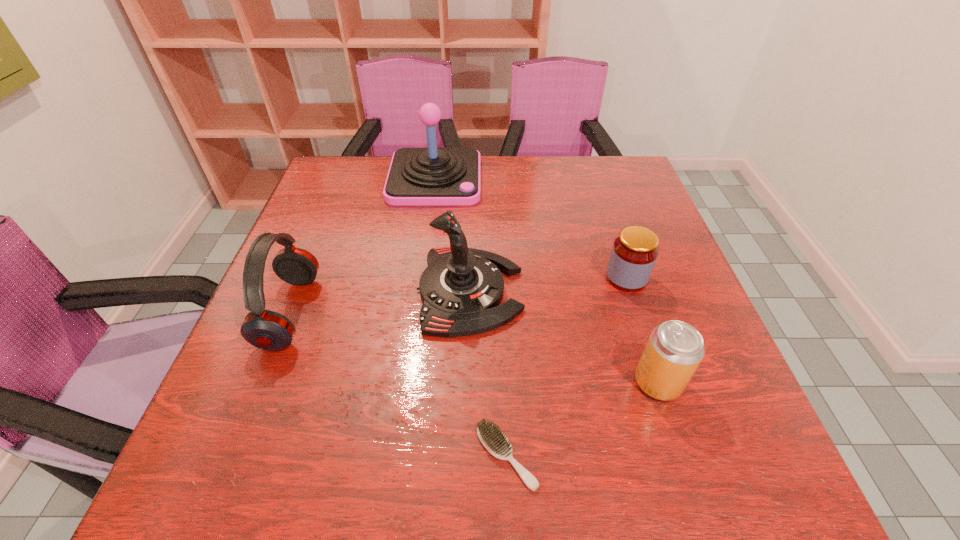
Locate an element on the screen. The width and height of the screenshot is (960, 540). the farthest object is located at coordinates tap(432, 176).

Find the location of `the nearer joystick`. the nearer joystick is located at coordinates (461, 289).

Locate an element on the screen. the leftmost object is located at coordinates (268, 330).

At what (x,y) coordinates should I click in order to perform the action: click on the fifth farthest object. Please return your answer as a coordinate pair (x, y). The height and width of the screenshot is (540, 960). Looking at the image, I should click on (674, 350).

At what (x,y) coordinates should I click in order to perform the action: click on jar. Please return your answer as a coordinate pair (x, y). The image size is (960, 540). Looking at the image, I should click on (634, 253).

Where is `the nearest object`? The width and height of the screenshot is (960, 540). the nearest object is located at coordinates (493, 439).

Identify the location of scrubbing brush. The width and height of the screenshot is (960, 540). (493, 439).

Locate an element on the screen. vacant area situated 0.340m forward from the base of the farthest object is located at coordinates (420, 299).

Locate an element on the screen. The image size is (960, 540). vacant space located 0.260m on the handle side of the nearer joystick is located at coordinates (640, 291).

Identify the location of vacant area situated on the ear cups of the earphone. This screenshot has height=540, width=960. (460, 312).